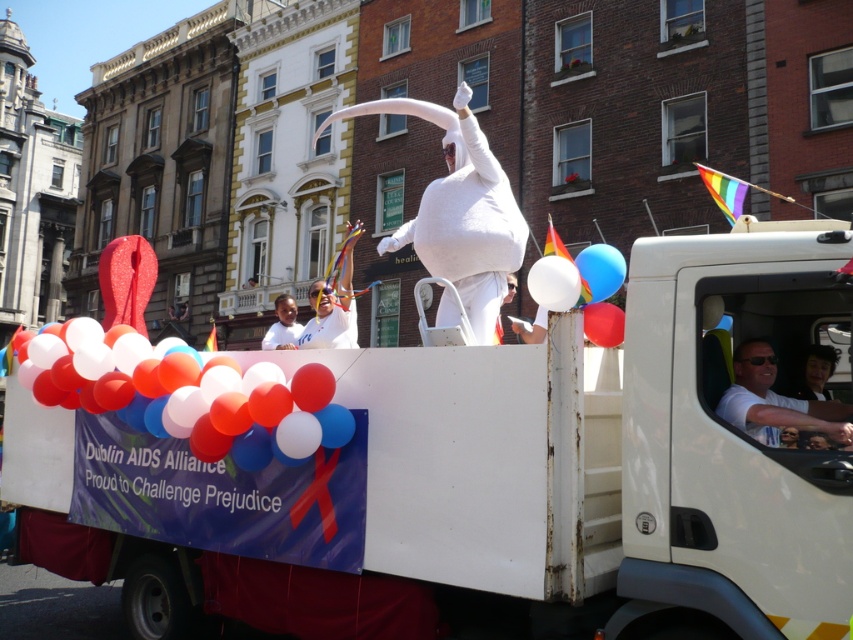
Can you confirm if white matte truck driver at center is bigger than white matte balloon at center?

Incorrect, white matte truck driver at center is not larger than white matte balloon at center.

Locate an element on the screen. The image size is (853, 640). white matte truck driver at center is located at coordinates (776, 401).

Locate an element on the screen. This screenshot has width=853, height=640. white matte truck driver at center is located at coordinates (776, 401).

Who is more distant from viewer, (608, 285) or (819, 397)?

Point (608, 285)

Does point (583, 276) come farther from viewer compared to point (808, 346)?

No.

Locate an element on the screen. The width and height of the screenshot is (853, 640). blue glossy balloon at upper right is located at coordinates (601, 269).

Does point (769, 378) lie behind point (579, 262)?

No, it is in front of (579, 262).

Is point (822, 406) positioned in front of point (614, 262)?

That is True.

Which is in front, point (805, 419) or point (605, 244)?

Point (805, 419)

Where is `white matte truck driver at center`? This screenshot has width=853, height=640. white matte truck driver at center is located at coordinates pos(776,401).